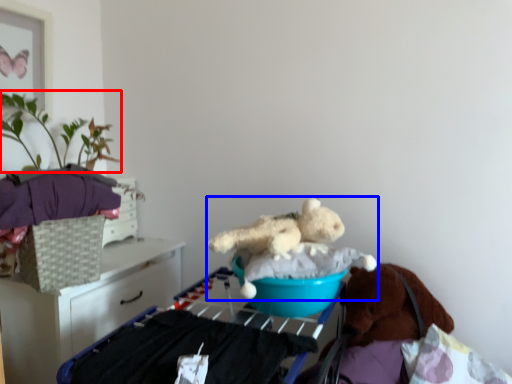
Question: Which point is closer to the camera, plant (highlighted by a red box) or teddy bear (highlighted by a blue box)?

Choices:
 (A) plant
 (B) teddy bear

Answer: (B)